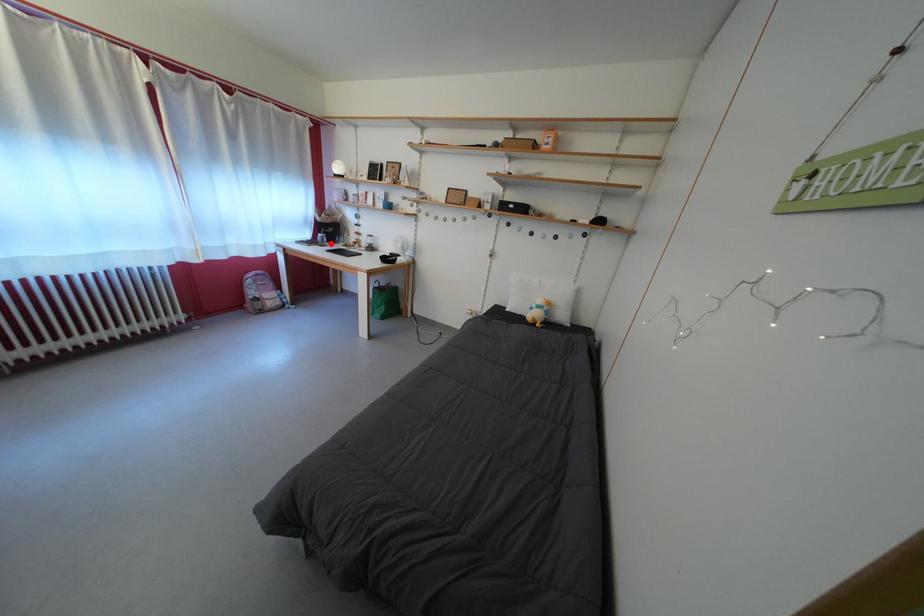
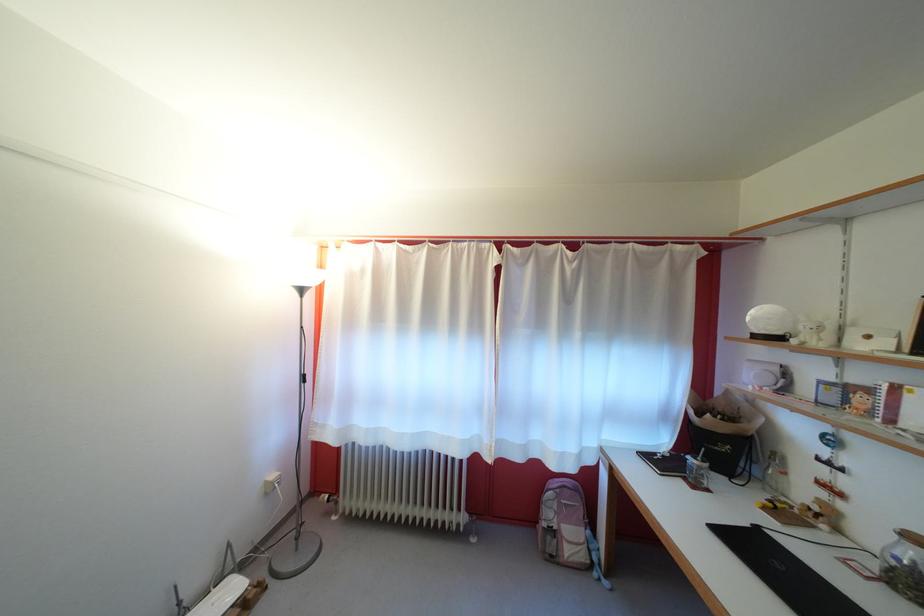
Question: I am providing you with two images of the same scene from different viewpoints. A red point is marked on the first image. Is the red point's position out of view in image 2?

Choices:
 (A) Yes
 (B) No

Answer: (B)